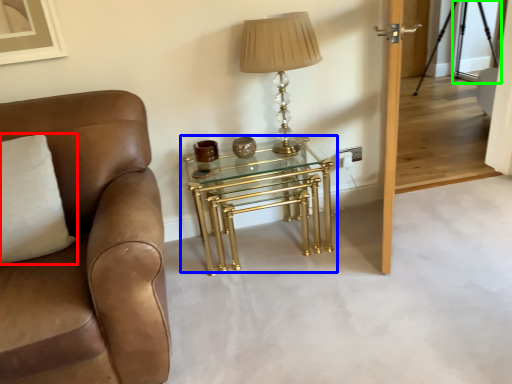
Question: Which is farther away from pillow (highlighted by a red box)? table (highlighted by a blue box) or glass door (highlighted by a green box)?

Choices:
 (A) table
 (B) glass door

Answer: (B)